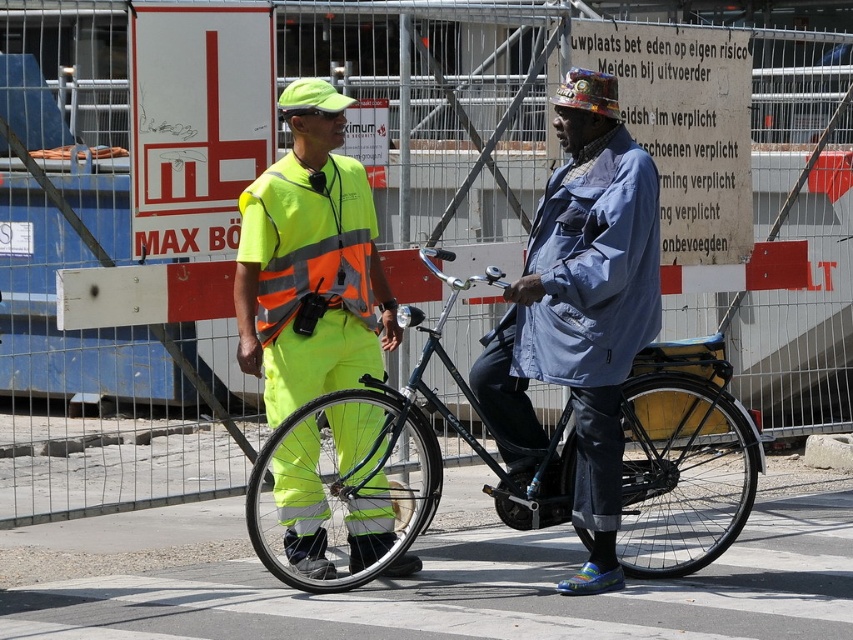
Is denim jacket at center positioned behind shiny black bicycle at center?

That is True.

Is denim jacket at center below shiny black bicycle at center?

No, denim jacket at center is not below shiny black bicycle at center.

Find the location of a particular element. The width and height of the screenshot is (853, 640). denim jacket at center is located at coordinates (581, 308).

Locate an element on the screen. This screenshot has width=853, height=640. denim jacket at center is located at coordinates (581, 308).

Who is more forward, (317, 109) or (352, 212)?

Point (317, 109) is in front.

Where is `neon yellow reflective vest at center`? Image resolution: width=853 pixels, height=640 pixels. neon yellow reflective vest at center is located at coordinates (310, 262).

Locate an element on the screen. The height and width of the screenshot is (640, 853). neon yellow reflective vest at center is located at coordinates (310, 262).

Measure the distance between denim jacket at center and camera.

A distance of 23.46 feet exists between denim jacket at center and camera.

This screenshot has height=640, width=853. In order to click on denim jacket at center in this screenshot , I will do `click(581, 308)`.